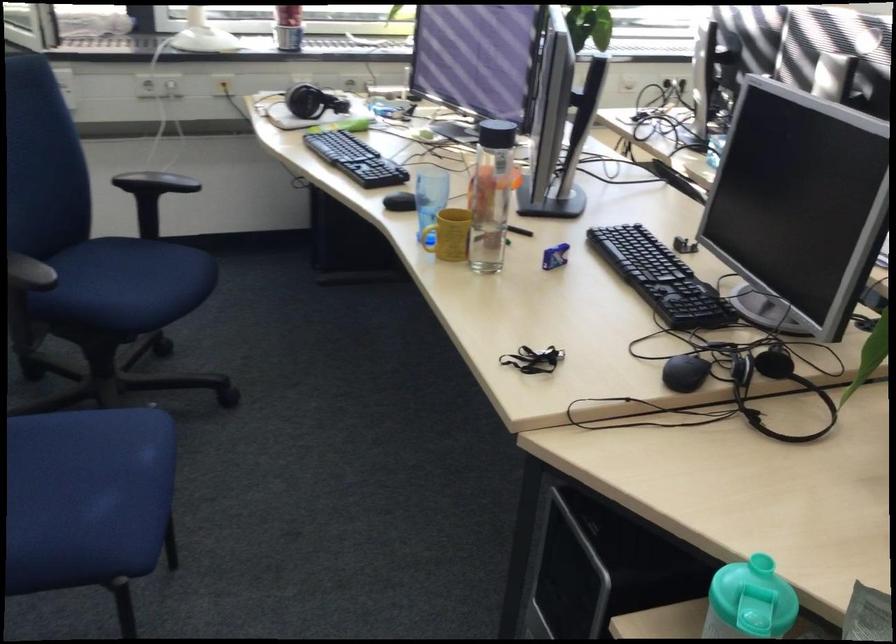
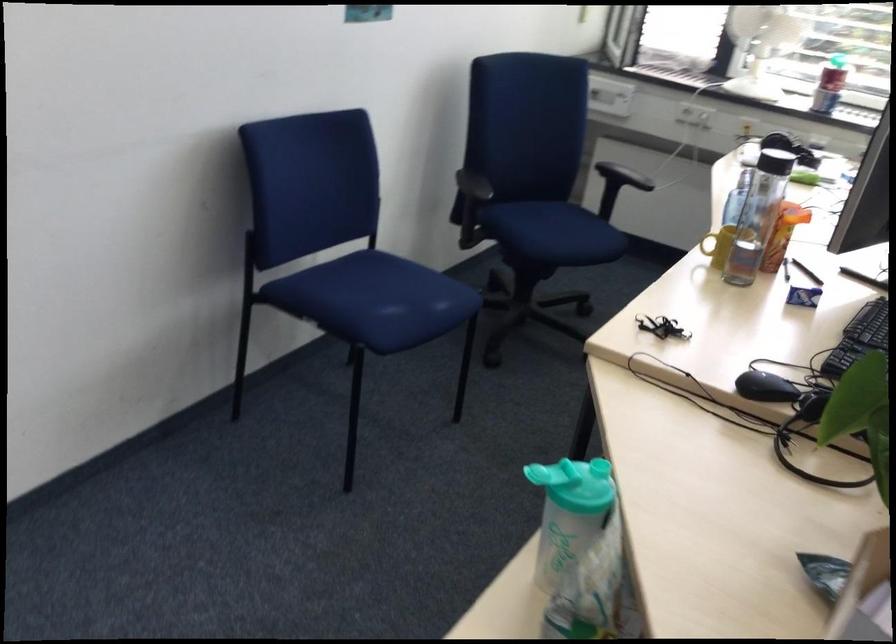
Find the pixel in the second image that matches pixel 524 351 in the first image.

(661, 327)